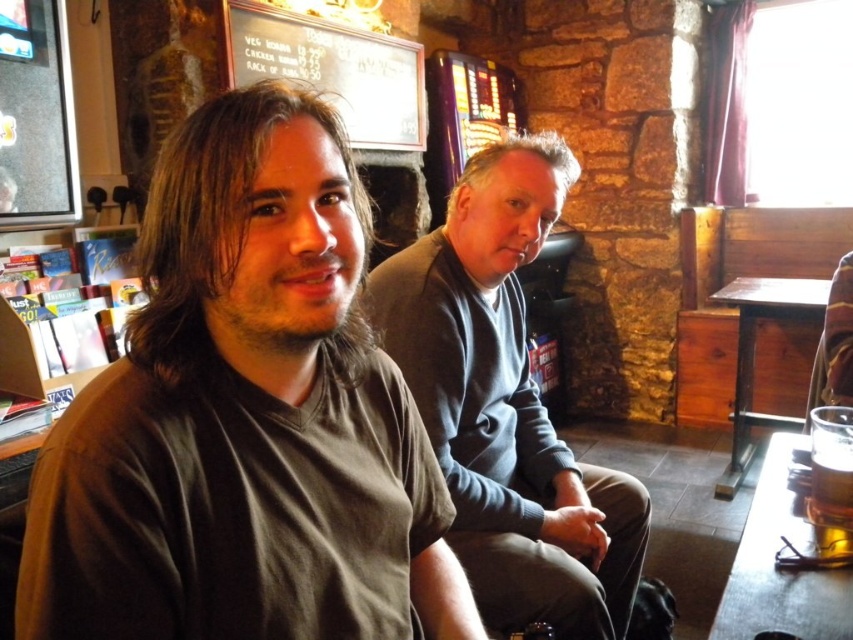
Looking at this image, you are a photographer setting up a shot of the wooden table at lower right and the golden amber liquid at lower right. Which object should you focus on first if you want to capture both in sharp detail?

The wooden table at lower right is located below the golden amber liquid at lower right, so focusing on the wooden table at lower right first would ensure both are in focus as the golden amber liquid is higher up and further away.

You are taking a photo of the two people in the scene. The first person is at point (560, 596) and the second person is at point (734, 381). Which person is closer to the camera?

The person at point (560, 596) is closer to the camera than the person at point (734, 381).

You are a photographer setting up a shot in this scene. You want to ensure both the brown matte shirt at left and the wooden table at lower right are in focus. Given that your camera has a depth of field that can cover 25 inches, will you be able to capture both objects clearly without refocusing?

The distance between the brown matte shirt at left and the wooden table at lower right is 26.15 inches. Since the camera can only cover 25 inches, you will need to refocus to ensure both are in focus.